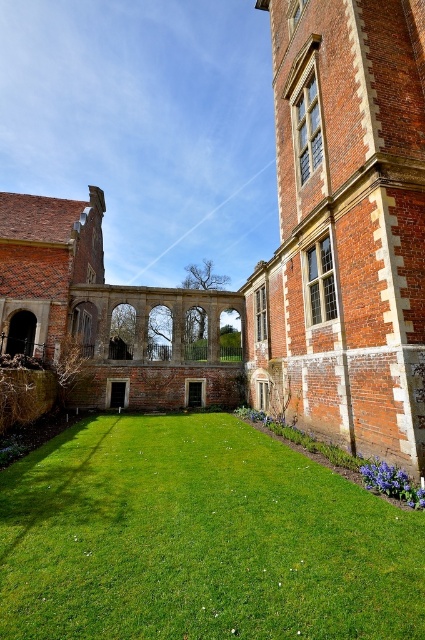
You are a delivery person with a cart that is 10 meters long. You need to move your cart from the brick wall at right to the red brick arches at center in the courtyard. Is your cart able to fit through the space between them?

The distance between the brick wall at right and red brick arches at center is 9.93 meters. Since the cart is 10 meters long, it is slightly too long to fit through the space between them.

You are a gardener who wants to plant a new flower bed in the courtyard. Considering the green grass at center and the brick wall at right, which one is shorter and thus more suitable for placing a small statue?

The green grass at center is shorter than the brick wall at right, so it would be more suitable for placing a small statue there.

You are standing in the courtyard and want to walk towards the green grass at center. Which direction should you face to move directly towards it?

The green grass at center is located at point coordinates, so you should face the center of the courtyard to move directly towards it.